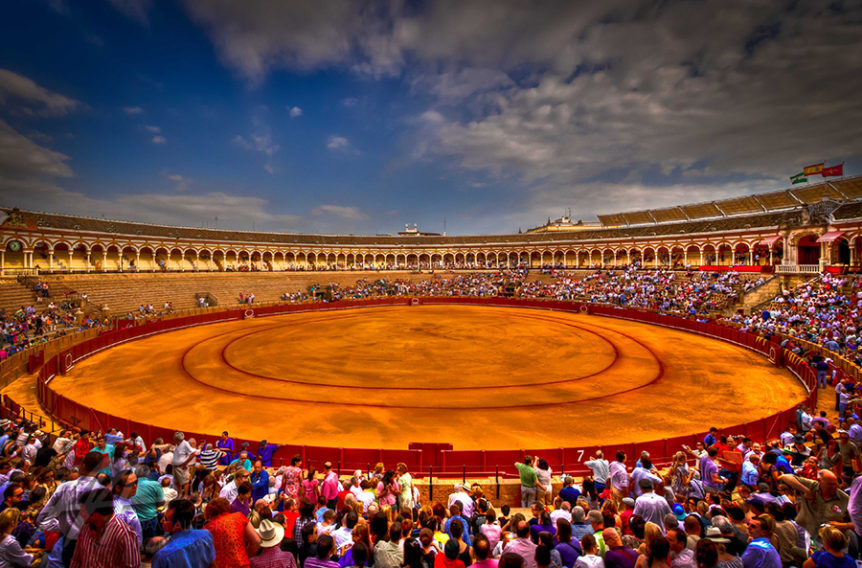
The height and width of the screenshot is (568, 862). Find the location of `archways upper level`. archways upper level is located at coordinates (40, 261), (116, 264), (201, 254), (264, 258), (358, 256), (442, 258), (534, 258), (659, 260), (733, 258).